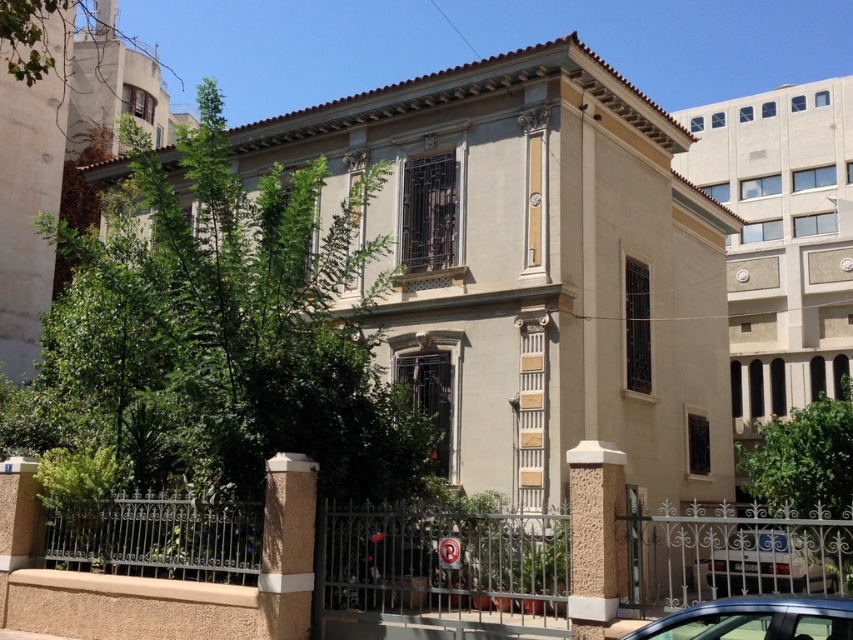
Who is more forward, (x=764, y=596) or (x=772, y=566)?

Point (x=764, y=596)

Is metallic blue car at lower right further to camera compared to white glossy car at lower right?

No, it is in front of white glossy car at lower right.

Locate an element on the screen. This screenshot has height=640, width=853. metallic blue car at lower right is located at coordinates (755, 620).

Find the location of a particular element. The height and width of the screenshot is (640, 853). metallic blue car at lower right is located at coordinates (755, 620).

Which is more to the right, black wrought iron fence at lower center or metallic blue car at lower right?

black wrought iron fence at lower center

Between black wrought iron fence at lower center and metallic blue car at lower right, which one is positioned lower?

black wrought iron fence at lower center is below.

Measure the distance between black wrought iron fence at lower center and camera.

A distance of 9.83 meters exists between black wrought iron fence at lower center and camera.

You are a GUI agent. You are given a task and a screenshot of the screen. Output one action in this format:
    pyautogui.click(x=<x>, y=<y>)
    Task: Click on the black wrought iron fence at lower center
    The width and height of the screenshot is (853, 640).
    Given the screenshot: What is the action you would take?
    coord(440,566)

The image size is (853, 640). Describe the element at coordinates (440, 566) in the screenshot. I see `black wrought iron fence at lower center` at that location.

Which is behind, point (624, 518) or point (749, 580)?

Positioned behind is point (749, 580).

Find the location of `black wrought iron fence at lower center`. black wrought iron fence at lower center is located at coordinates (440, 566).